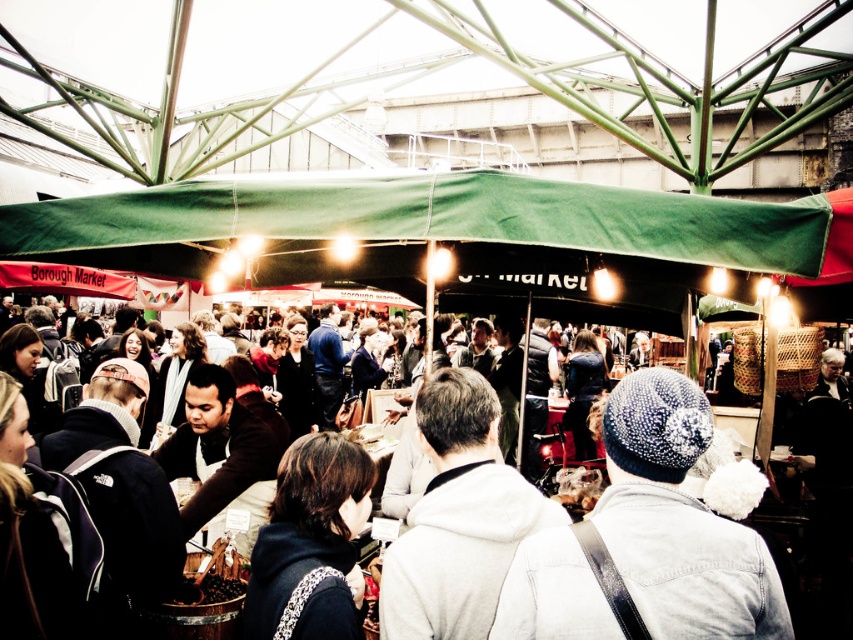
Can you confirm if green fabric canopy at center is thinner than white knitted hat at center?

Incorrect, green fabric canopy at center's width is not less than white knitted hat at center's.

Does green fabric canopy at center have a greater height compared to white knitted hat at center?

Incorrect, green fabric canopy at center's height is not larger of white knitted hat at center's.

Locate an element on the screen. This screenshot has height=640, width=853. green fabric canopy at center is located at coordinates (437, 230).

Does green fabric canopy at center have a lesser width compared to white fleece jacket at center?

No.

Does green fabric canopy at center appear over white fleece jacket at center?

Yes.

Image resolution: width=853 pixels, height=640 pixels. Identify the location of green fabric canopy at center. (437, 230).

At what (x,y) coordinates should I click in order to perform the action: click on green fabric canopy at center. Please return your answer as a coordinate pair (x, y). Looking at the image, I should click on (437, 230).

Is white knitted hat at center above white fleece jacket at center?

Incorrect, white knitted hat at center is not positioned above white fleece jacket at center.

Does point (532, 618) come in front of point (465, 515)?

Yes, it is.

The width and height of the screenshot is (853, 640). Identify the location of white knitted hat at center. (677, 520).